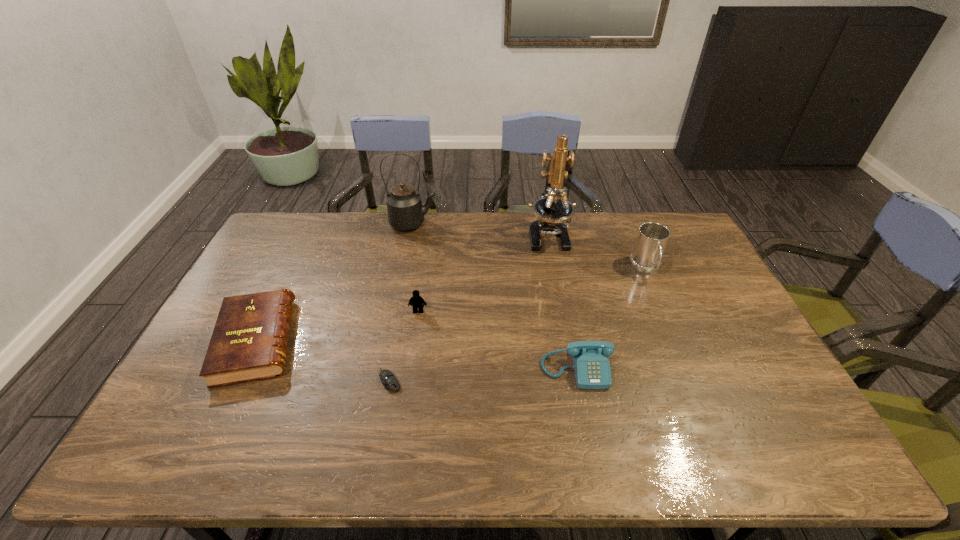
Locate an element on the screen. Image resolution: width=960 pixels, height=540 pixels. free space located 0.360m spout on the sixth shortest object is located at coordinates (534, 224).

Where is `free space located on the side of the fifth shortest object with the handle`? Image resolution: width=960 pixels, height=540 pixels. free space located on the side of the fifth shortest object with the handle is located at coordinates (680, 349).

At what (x,y) coordinates should I click in order to perform the action: click on vacant space located 0.180m on the face of the Lego. Please return your answer as a coordinate pair (x, y). This screenshot has height=540, width=960. Looking at the image, I should click on (411, 362).

Locate an element on the screen. vacant space situated on the dial of the fifth tallest object is located at coordinates (590, 437).

I want to click on vacant space located on the back of the second shortest object, so click(298, 256).

In order to click on vacant area situated 0.150m on the back of the computer mouse in this screenshot , I will do `click(399, 327)`.

This screenshot has width=960, height=540. What are the coordinates of `microscope situated at the far edge` in the screenshot? It's located at (552, 211).

Locate an element on the screen. kettle that is at the far edge is located at coordinates (405, 211).

Where is `object present at the left edge`? object present at the left edge is located at coordinates (249, 342).

At what (x,y) coordinates should I click in order to perform the action: click on vacant space at the far edge. Please return your answer as a coordinate pair (x, y). Looking at the image, I should click on (335, 239).